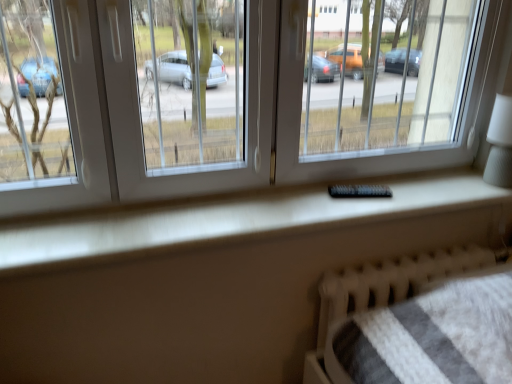
Find the location of a particular element. white knitted hospital bed at lower right is located at coordinates (384, 288).

Where is `white knitted hospital bed at lower right`? Image resolution: width=512 pixels, height=384 pixels. white knitted hospital bed at lower right is located at coordinates (384, 288).

Considering the relative sizes of transparent plastic window at center and white knitted hospital bed at lower right in the image provided, is transparent plastic window at center smaller than white knitted hospital bed at lower right?

No.

Is transparent plastic window at center oriented away from white knitted hospital bed at lower right?

That's not correct — transparent plastic window at center is not looking away from white knitted hospital bed at lower right.

Considering the positions of objects transparent plastic window at center and white knitted hospital bed at lower right in the image provided, who is more to the right, transparent plastic window at center or white knitted hospital bed at lower right?

Positioned to the right is white knitted hospital bed at lower right.

This screenshot has width=512, height=384. Find the location of `hospital bed on the right of transparent plastic window at center`. hospital bed on the right of transparent plastic window at center is located at coordinates (384, 288).

Would you say white knitted hospital bed at lower right is a long distance from transparent plastic window at center?

white knitted hospital bed at lower right is near transparent plastic window at center, not far away.

Is white knitted hospital bed at lower right positioned with its back to transparent plastic window at center?

white knitted hospital bed at lower right does not have its back to transparent plastic window at center.

Where is `window that is on the left side of white knitted hospital bed at lower right`? window that is on the left side of white knitted hospital bed at lower right is located at coordinates (266, 97).

From a real-world perspective, relative to transparent plastic window at center, is white knitted hospital bed at lower right vertically above or below?

Clearly, from a real-world perspective, white knitted hospital bed at lower right is below transparent plastic window at center.

Which is in front, transparent plastic window at center or black plastic remote at center?

Positioned in front is transparent plastic window at center.

In the scene shown: From a real-world perspective, does transparent plastic window at center sit lower than black plastic remote at center?

Incorrect, from a real-world perspective, transparent plastic window at center is higher than black plastic remote at center.

Measure the distance between transparent plastic window at center and black plastic remote at center.

transparent plastic window at center and black plastic remote at center are 18.15 inches apart from each other.

Does transparent plastic window at center contain black plastic remote at center?

That's correct, black plastic remote at center is inside transparent plastic window at center.

Is black plastic remote at center positioned with its back to transparent plastic window at center?

No, black plastic remote at center is not facing away from transparent plastic window at center.

From a real-world perspective, who is located higher, black plastic remote at center or transparent plastic window at center?

In real-world perspective, transparent plastic window at center is above.

Is transparent plastic window at center completely or partially inside black plastic remote at center?

No, transparent plastic window at center is located outside of black plastic remote at center.

From the picture: From the image's perspective, which is above, white knitted hospital bed at lower right or white textured lampshade at right?

white textured lampshade at right appears higher in the image.

Based on their positions, is white knitted hospital bed at lower right located to the left or right of white textured lampshade at right?

white knitted hospital bed at lower right is positioned on white textured lampshade at right's left side.

Is white knitted hospital bed at lower right turned away from white textured lampshade at right?

That's not correct — white knitted hospital bed at lower right is not looking away from white textured lampshade at right.

Is white textured lampshade at right facing away from black plastic remote at center?

No.

In the image, there is a white textured lampshade at right. At what (x,y) coordinates should I click in order to perform the action: click on remote below it (from the image's perspective). Please return your answer as a coordinate pair (x, y). Looking at the image, I should click on (359, 191).

Which object is closer to the camera, white textured lampshade at right or black plastic remote at center?

white textured lampshade at right is in front.

Is white textured lampshade at right positioned far away from black plastic remote at center?

No, white textured lampshade at right is not far from black plastic remote at center.

Is white textured lampshade at right located outside transparent plastic window at center?

No, white textured lampshade at right is inside or overlapping with transparent plastic window at center.

In the scene shown: Considering the sizes of objects white textured lampshade at right and transparent plastic window at center in the image provided, who is shorter, white textured lampshade at right or transparent plastic window at center?

Result: white textured lampshade at right is shorter.

From the image's perspective, between white textured lampshade at right and transparent plastic window at center, which one is located above?

transparent plastic window at center, from the image's perspective.

Which is in front, white textured lampshade at right or transparent plastic window at center?

transparent plastic window at center is closer to the camera.

The image size is (512, 384). Find the location of `window in front of the white knitted hospital bed at lower right`. window in front of the white knitted hospital bed at lower right is located at coordinates (266, 97).

Where is `hospital bed that is on the right side of transparent plastic window at center`? This screenshot has width=512, height=384. hospital bed that is on the right side of transparent plastic window at center is located at coordinates (384, 288).

Looking at the image, which one is located further to black plastic remote at center, white knitted hospital bed at lower right or white textured lampshade at right?

white textured lampshade at right is further to black plastic remote at center.

Which object lies further to the anchor point white knitted hospital bed at lower right, transparent plastic window at center or black plastic remote at center?

Among the two, transparent plastic window at center is located further to white knitted hospital bed at lower right.

Considering their positions, is white knitted hospital bed at lower right positioned closer to white textured lampshade at right than black plastic remote at center?

black plastic remote at center is positioned closer to the anchor white textured lampshade at right.

Based on their spatial positions, is white knitted hospital bed at lower right or transparent plastic window at center closer to black plastic remote at center?

The object closer to black plastic remote at center is white knitted hospital bed at lower right.

When comparing their distances from white textured lampshade at right, does black plastic remote at center or transparent plastic window at center seem further?

The object further to white textured lampshade at right is black plastic remote at center.

From the image, which object appears to be farther from white textured lampshade at right, white knitted hospital bed at lower right or transparent plastic window at center?

The object further to white textured lampshade at right is white knitted hospital bed at lower right.

When comparing their distances from white textured lampshade at right, does black plastic remote at center or white knitted hospital bed at lower right seem further?

white knitted hospital bed at lower right is positioned further to the anchor white textured lampshade at right.

Consider the image. Estimate the real-world distances between objects in this image. Which object is further from transparent plastic window at center, black plastic remote at center or white textured lampshade at right?

black plastic remote at center is positioned further to the anchor transparent plastic window at center.

Where is `remote between white textured lampshade at right and white knitted hospital bed at lower right in the vertical direction`? The image size is (512, 384). remote between white textured lampshade at right and white knitted hospital bed at lower right in the vertical direction is located at coordinates (359, 191).

Find the location of `remote between transparent plastic window at center and white knitted hospital bed at lower right vertically`. remote between transparent plastic window at center and white knitted hospital bed at lower right vertically is located at coordinates (359, 191).

Where is `remote between transparent plastic window at center and white textured lampshade at right`? The height and width of the screenshot is (384, 512). remote between transparent plastic window at center and white textured lampshade at right is located at coordinates (359, 191).

Locate an element on the screen. The image size is (512, 384). table lamp that lies between transparent plastic window at center and white knitted hospital bed at lower right from top to bottom is located at coordinates (500, 143).